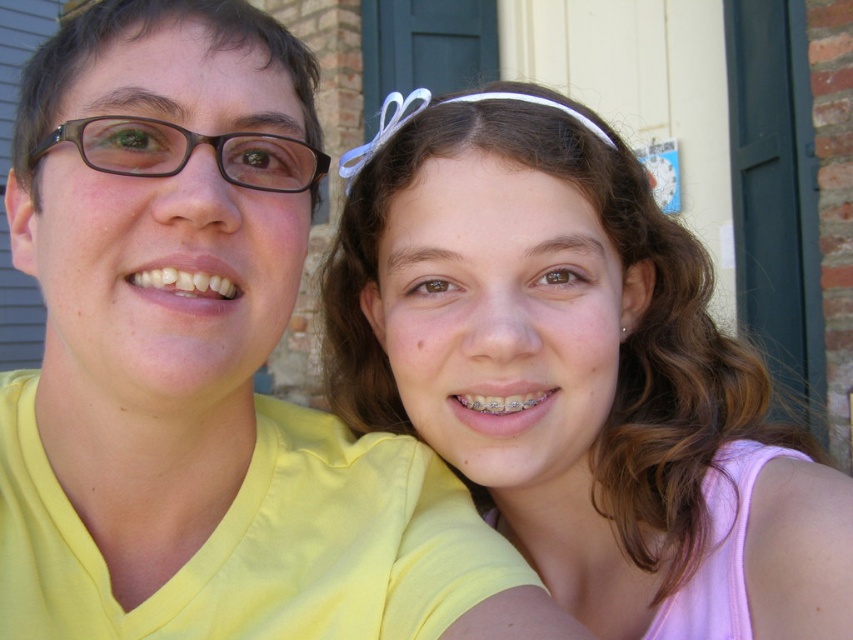
You are an observer looking at the image. You notice the pink fabric headband at upper center and the brown matte glasses at left. Which object is positioned lower in the image?

The pink fabric headband at upper center is located below brown matte glasses at left, so the pink fabric headband at upper center is positioned lower.